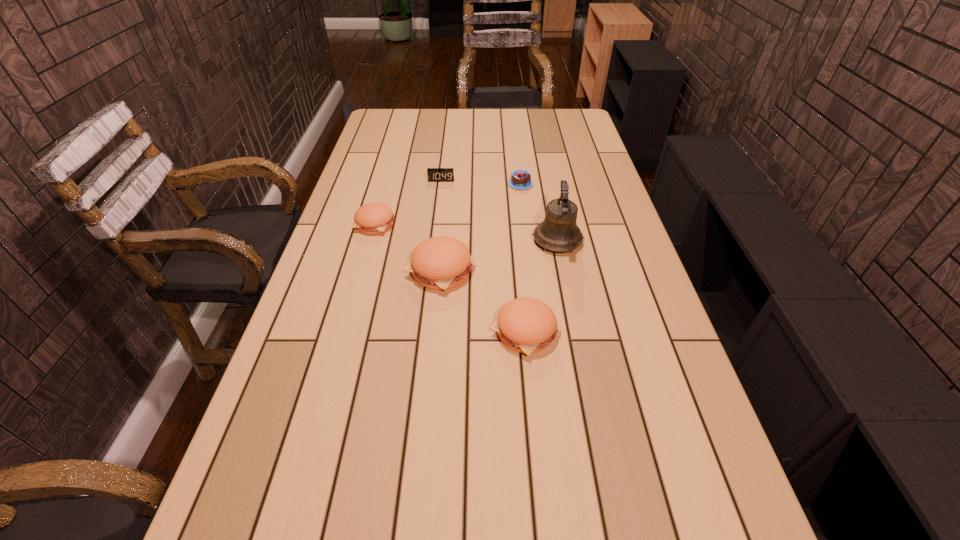
What are the coordinates of `the leftmost object` in the screenshot? It's located at (373, 218).

Locate an element on the screen. This screenshot has height=540, width=960. the leftmost patty is located at coordinates (373, 218).

The height and width of the screenshot is (540, 960). I want to click on the second farthest patty, so click(439, 263).

I want to click on the third tallest object, so click(526, 325).

Locate an element on the screen. This screenshot has height=540, width=960. the nearest patty is located at coordinates (526, 325).

I want to click on the tallest object, so click(x=559, y=232).

You are a GUI agent. You are given a task and a screenshot of the screen. Output one action in this format:
    pyautogui.click(x=<x>, y=<y>)
    Task: Click on the alarm clock
    
    Given the screenshot: What is the action you would take?
    pyautogui.click(x=434, y=174)

Locate an element on the screen. The width and height of the screenshot is (960, 540). chocolate cake is located at coordinates (520, 179).

Find the location of a particular element. Image resolution: width=960 pixels, height=540 pixels. blank space located on the front of the shortest patty is located at coordinates (363, 270).

At what (x,y) coordinates should I click in order to perform the action: click on vacant space situated 0.180m on the back of the second nearest patty. Please return your answer as a coordinate pair (x, y). Looking at the image, I should click on (446, 212).